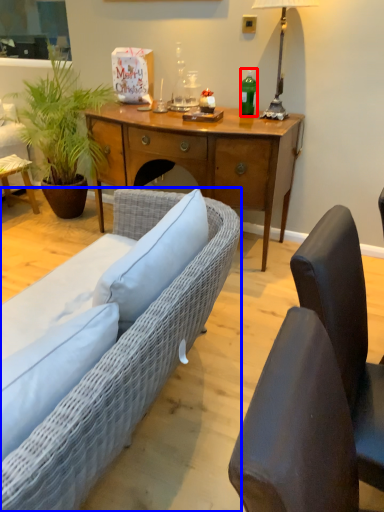
Question: Which object appears farthest to the camera in this image, bottle (highlighted by a red box) or studio couch (highlighted by a blue box)?

Choices:
 (A) bottle
 (B) studio couch

Answer: (A)